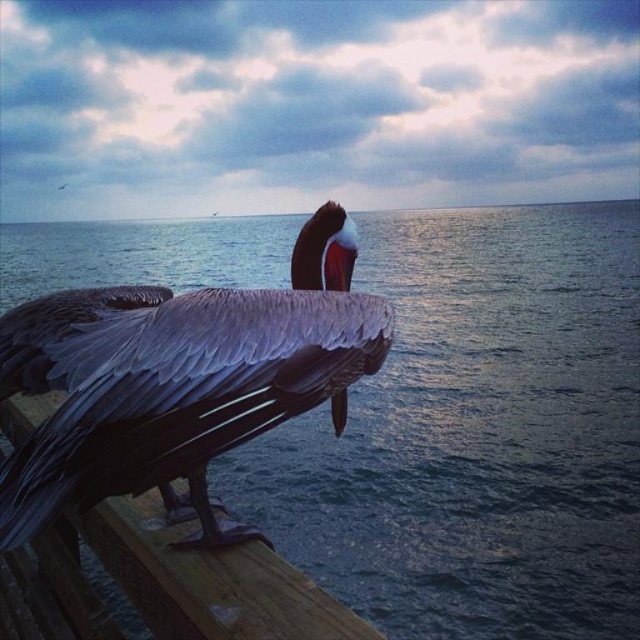
You are a photographer aiming to capture the gray feathered pelican at center and the wooden at left in a single shot. Based on their positions, can you fit both into the frame without moving the camera?

The gray feathered pelican at center is above the wooden at left, so yes, you can fit both into the frame since they are vertically aligned.

You are a photographer positioned at the origin point of the image coordinate system. You want to capture the gray feathered pelican at center in your shot. What are the coordinates where you should aim your camera?

The gray feathered pelican at center is located at coordinates 0.592 on the x axis and 0.281 on the y axis, so you should aim your camera at those coordinates to capture it.

You are a photographer aiming to capture the gray feathered pelican at center and the wooden at left in your shot. From your current position, can you see both objects simultaneously?

Yes, because the wooden at left is behind the gray feathered pelican at center, so both can be seen in the same frame.